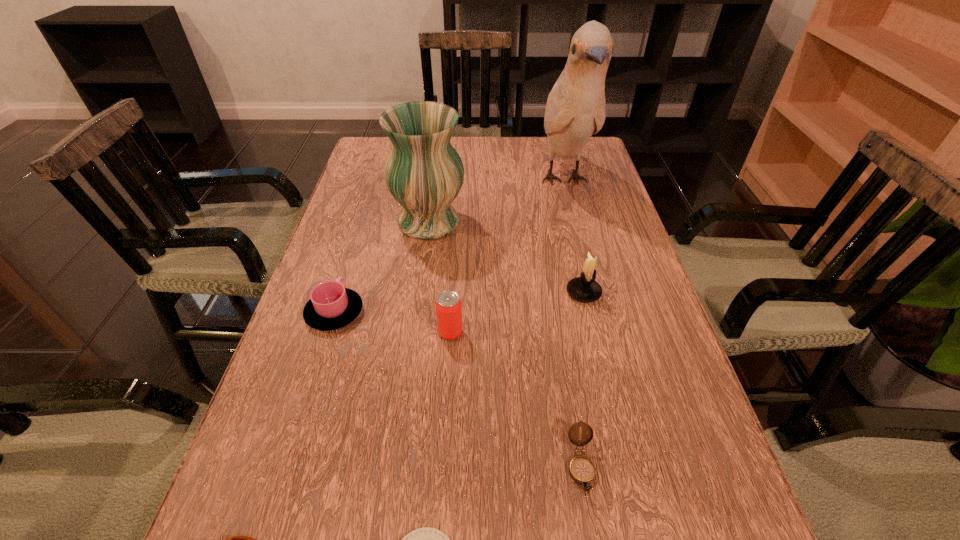
Where is `the tallest object`? This screenshot has height=540, width=960. the tallest object is located at coordinates (575, 110).

Locate an element on the screen. This screenshot has width=960, height=540. vase is located at coordinates (424, 173).

This screenshot has height=540, width=960. In order to click on the third tallest object in this screenshot , I will do `click(584, 288)`.

You are a GUI agent. You are given a task and a screenshot of the screen. Output one action in this format:
    pyautogui.click(x=<x>, y=<y>)
    Task: Click on the fifth shortest object
    The width and height of the screenshot is (960, 540).
    Given the screenshot: What is the action you would take?
    pyautogui.click(x=448, y=305)

Find the location of `cup`. cup is located at coordinates (331, 306).

What are the coordinates of `the third nearest object` in the screenshot? It's located at (582, 470).

This screenshot has width=960, height=540. What are the coordinates of `the farthest compass` in the screenshot? It's located at (582, 470).

Where is `free location located 0.090m on the face of the parakeet`? The height and width of the screenshot is (540, 960). free location located 0.090m on the face of the parakeet is located at coordinates (579, 243).

Find the location of `vacant space situated on the back of the second tallest object`. vacant space situated on the back of the second tallest object is located at coordinates (438, 160).

Locate an element on the screen. The height and width of the screenshot is (540, 960). vacant space located 0.340m on the back of the candle holder is located at coordinates (561, 195).